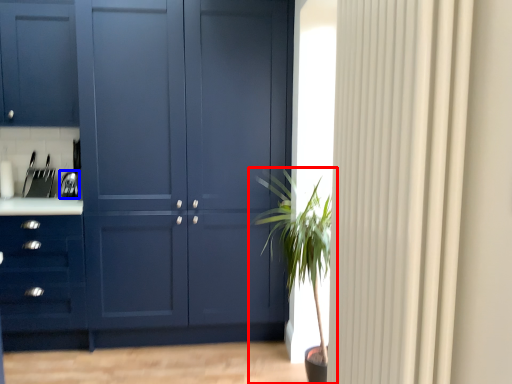
Question: Which object appears farthest to the camera in this image, houseplant (highlighted by a red box) or appliance (highlighted by a blue box)?

Choices:
 (A) houseplant
 (B) appliance

Answer: (B)